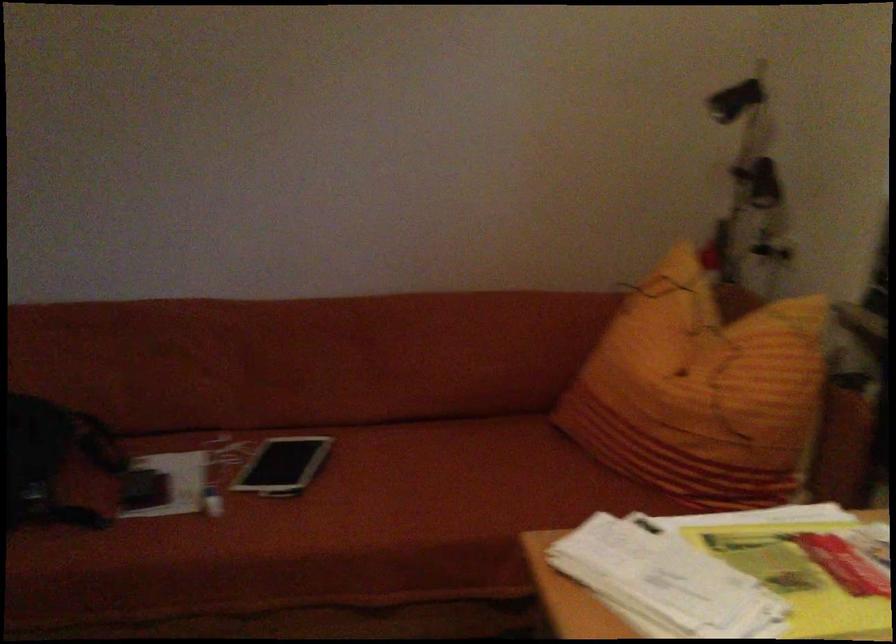
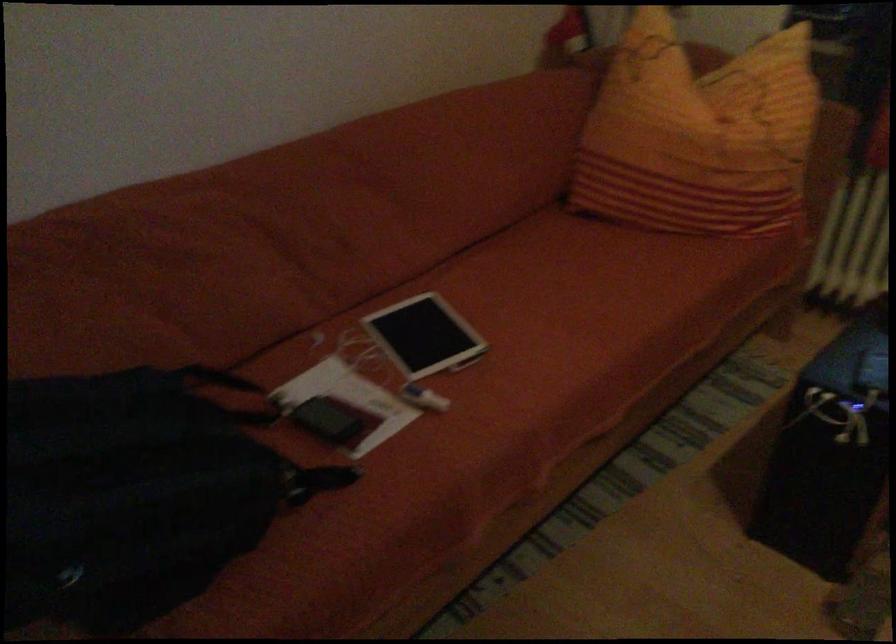
Where in the second image is the point corresponding to [648,377] from the first image?

(698, 135)